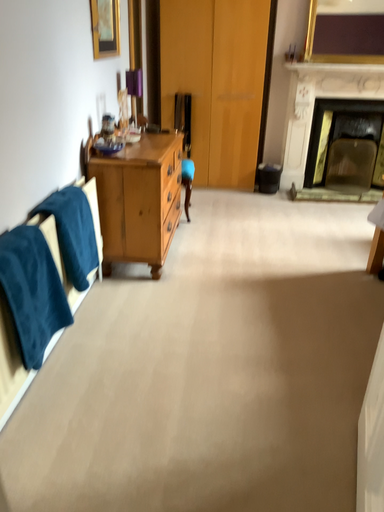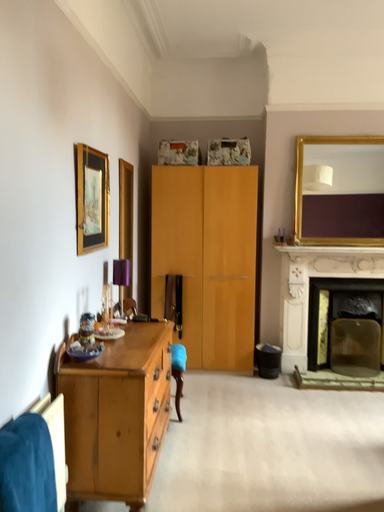
Question: How did the camera likely rotate when shooting the video?

Choices:
 (A) rotated downward
 (B) rotated upward

Answer: (B)